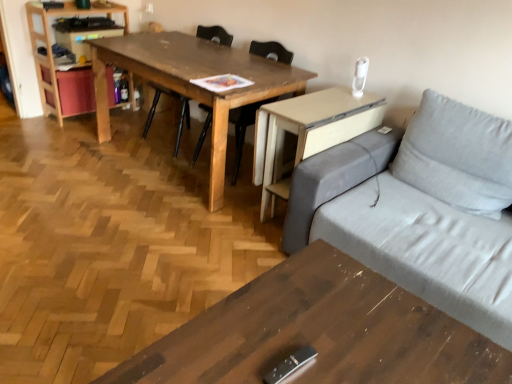
Image resolution: width=512 pixels, height=384 pixels. Identify the location of vacant space that's between wooden coffee table at lower center, which ranks as the 2th table in top-to-bottom order, and light wood bookshelf at left. (130, 214).